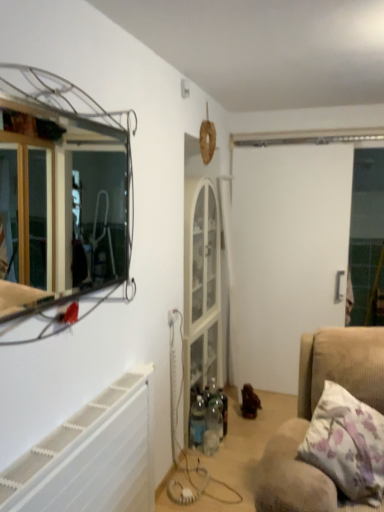
Identify the location of empty space that is ontop of white matte screen door at center. The height and width of the screenshot is (512, 384). (297, 142).